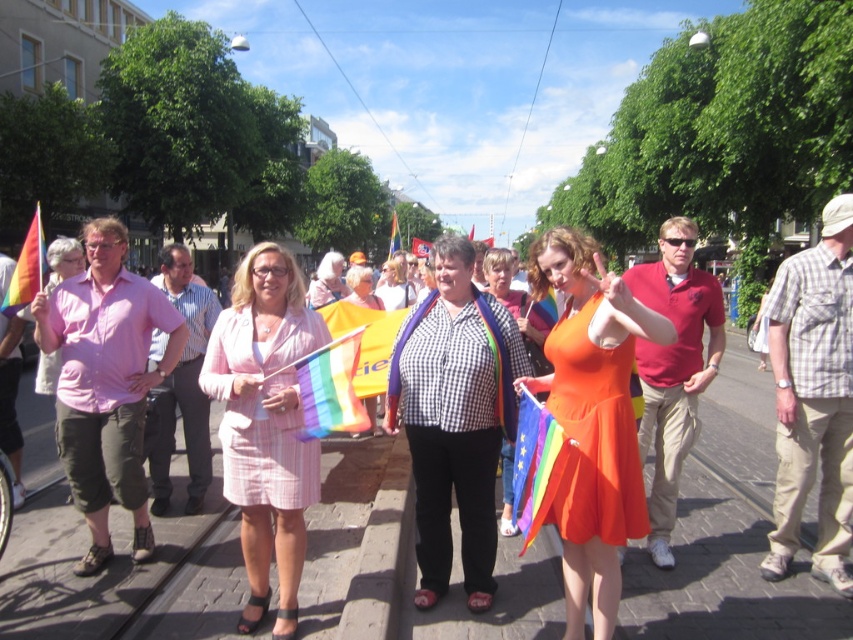
Question: Does orange satin dress at center appear over orange cotton dress at center?

Choices:
 (A) no
 (B) yes

Answer: (A)

Question: Where is pink checkered suit at center located in relation to orange cotton dress at center in the image?

Choices:
 (A) below
 (B) above

Answer: (A)

Question: Which point is farther from the camera taking this photo?

Choices:
 (A) (244, 275)
 (B) (666, 326)

Answer: (A)

Question: Can you confirm if orange satin dress at center is positioned above orange cotton dress at center?

Choices:
 (A) yes
 (B) no

Answer: (B)

Question: Which point appears farthest from the camera in this image?

Choices:
 (A) (374, 410)
 (B) (577, 449)

Answer: (A)

Question: Considering the real-world distances, which object is farthest from the orange satin dress at center?

Choices:
 (A) pink checkered suit at center
 (B) orange cotton dress at center

Answer: (B)